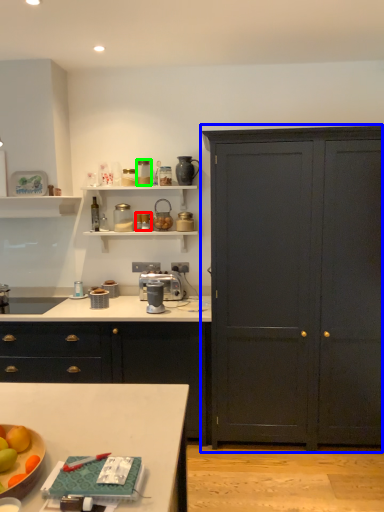
Question: Which object is the farthest from appliance (highlighted by a red box)? Choose among these: cupboard (highlighted by a blue box) or appliance (highlighted by a green box).

Choices:
 (A) cupboard
 (B) appliance

Answer: (A)